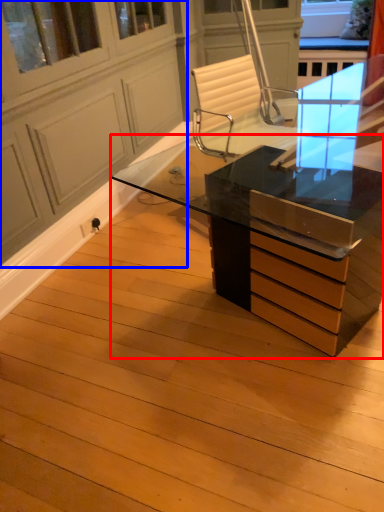
Question: Which of the following is the closest to the observer, desk (highlighted by a red box) or screen door (highlighted by a blue box)?

Choices:
 (A) desk
 (B) screen door

Answer: (B)